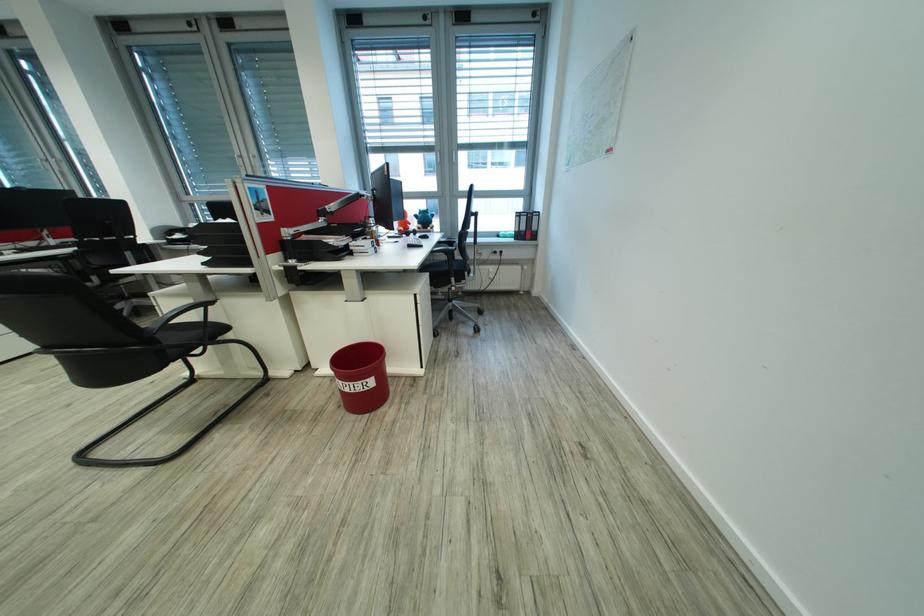
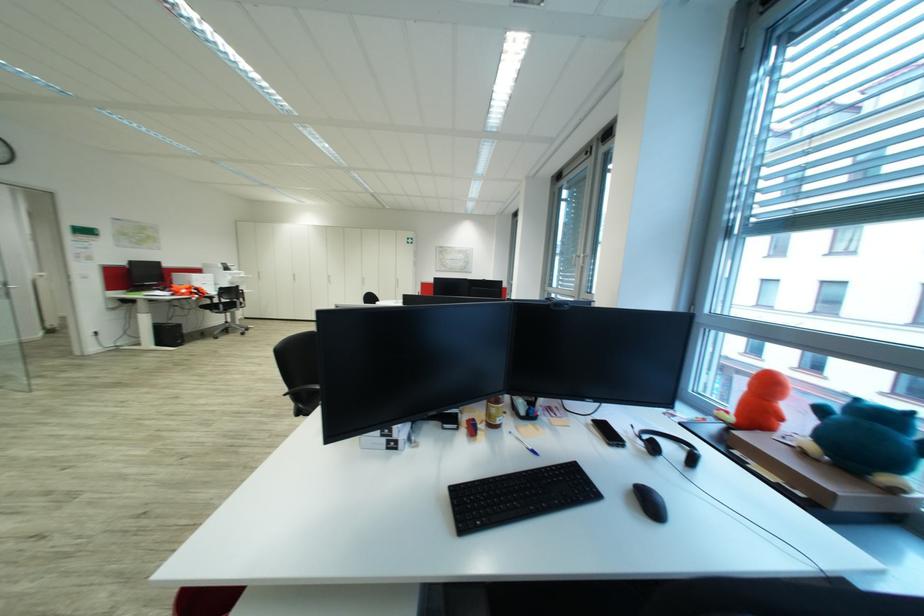
In the second image, find the point that corresponds to (x=248, y=153) in the first image.

(582, 253)